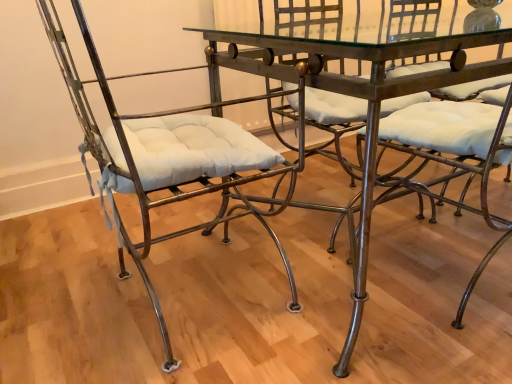
Question: Is metallic glass table at center smaller than metallic wrought iron chair at center, which is the first chair in right-to-left order?

Choices:
 (A) yes
 (B) no

Answer: (B)

Question: Does metallic glass table at center have a lesser height compared to metallic wrought iron chair at center, which ranks as the second chair in left-to-right order?

Choices:
 (A) no
 (B) yes

Answer: (B)

Question: Considering the relative sizes of metallic glass table at center and metallic wrought iron chair at center, which ranks as the second chair in left-to-right order, in the image provided, is metallic glass table at center taller than metallic wrought iron chair at center, which ranks as the second chair in left-to-right order,?

Choices:
 (A) yes
 (B) no

Answer: (B)

Question: From the image's perspective, does metallic glass table at center appear lower than metallic wrought iron chair at center, which is the first chair in right-to-left order?

Choices:
 (A) no
 (B) yes

Answer: (A)

Question: From a real-world perspective, is metallic glass table at center below metallic wrought iron chair at center, which ranks as the second chair in left-to-right order?

Choices:
 (A) yes
 (B) no

Answer: (A)

Question: Based on their sizes in the image, would you say metallic wrought iron chair at center, which is the first chair in right-to-left order, is bigger or smaller than matte metal chair at left, the 2th chair when ordered from right to left?

Choices:
 (A) small
 (B) big

Answer: (A)

Question: Is point (508, 162) positioned closer to the camera than point (147, 228)?

Choices:
 (A) farther
 (B) closer

Answer: (A)

Question: Is metallic wrought iron chair at center, which is the first chair in right-to-left order, taller or shorter than matte metal chair at left, the 2th chair when ordered from right to left?

Choices:
 (A) short
 (B) tall

Answer: (A)

Question: In terms of width, does metallic wrought iron chair at center, which is the first chair in right-to-left order, look wider or thinner when compared to matte metal chair at left, the first chair in the left-to-right sequence?

Choices:
 (A) thin
 (B) wide

Answer: (A)

Question: Considering the positions of point (272, 235) and point (497, 115), is point (272, 235) closer or farther from the camera than point (497, 115)?

Choices:
 (A) farther
 (B) closer

Answer: (A)

Question: From the image's perspective, is matte metal chair at left, the first chair in the left-to-right sequence, positioned above or below metallic wrought iron chair at center, which ranks as the second chair in left-to-right order?

Choices:
 (A) above
 (B) below

Answer: (B)

Question: In the image, is matte metal chair at left, the first chair in the left-to-right sequence, positioned in front of or behind metallic wrought iron chair at center, which is the first chair in right-to-left order?

Choices:
 (A) front
 (B) behind

Answer: (A)

Question: In terms of height, does matte metal chair at left, the 2th chair when ordered from right to left, look taller or shorter compared to metallic wrought iron chair at center, which is the first chair in right-to-left order?

Choices:
 (A) short
 (B) tall

Answer: (B)

Question: In the image, is matte metal chair at left, the 2th chair when ordered from right to left, positioned in front of or behind metallic glass table at center?

Choices:
 (A) front
 (B) behind

Answer: (A)

Question: From their relative heights in the image, would you say matte metal chair at left, the first chair in the left-to-right sequence, is taller or shorter than metallic glass table at center?

Choices:
 (A) short
 (B) tall

Answer: (B)